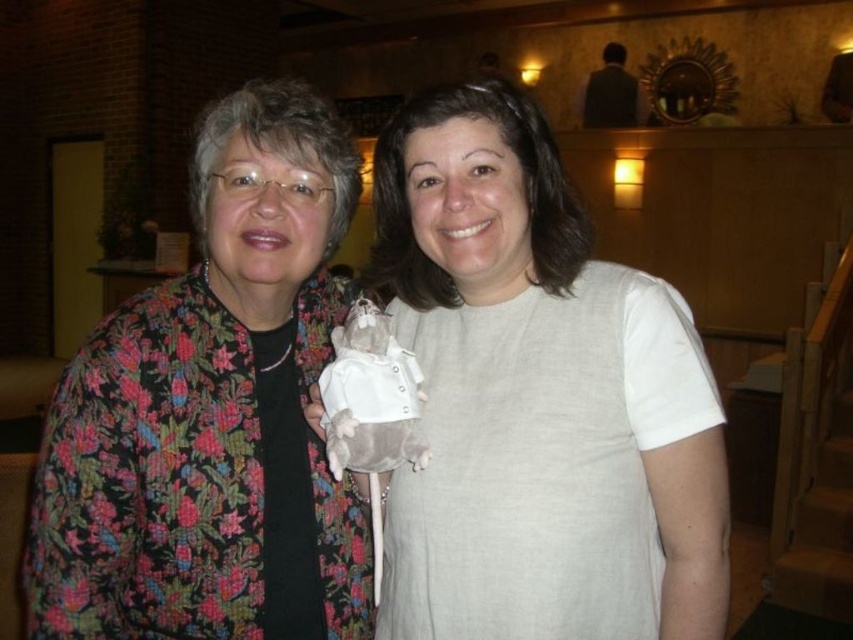
You are standing in the same room as the two people in the image. You want to place a small decoration exactly at the point with coordinates point (537, 397). Which object from the scene should you place it on?

The point (537, 397) is located on the white fabric doll at center, so you should place the decoration on the white fabric doll at center.